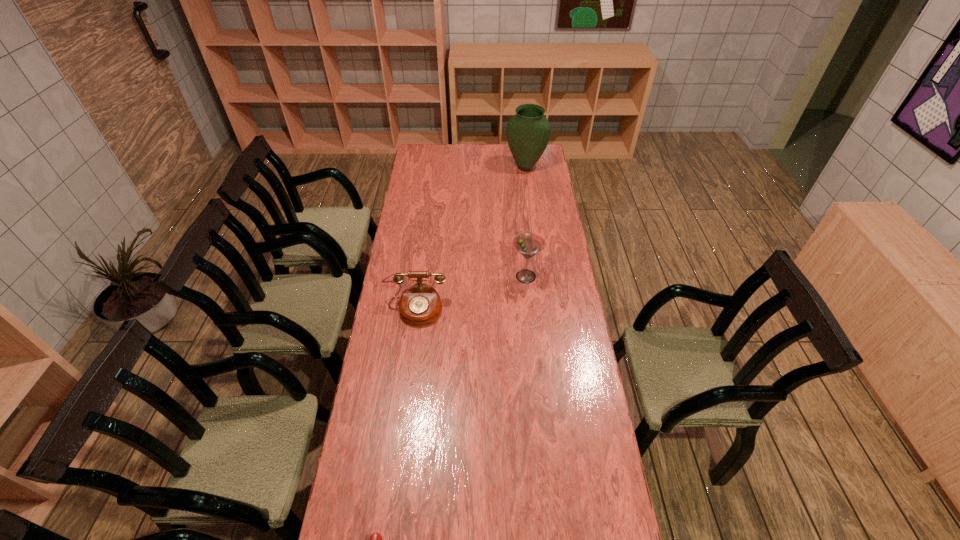
The width and height of the screenshot is (960, 540). What are the coordinates of `free spot between the second shortest object and the farthest object` in the screenshot? It's located at (x=470, y=238).

The width and height of the screenshot is (960, 540). Find the location of `object that is the closest to the third nearest object`. object that is the closest to the third nearest object is located at coordinates (420, 304).

Find the location of a particular element. Image resolution: width=960 pixels, height=540 pixels. object that can be found as the second closest to the shorter telephone is located at coordinates tap(528, 244).